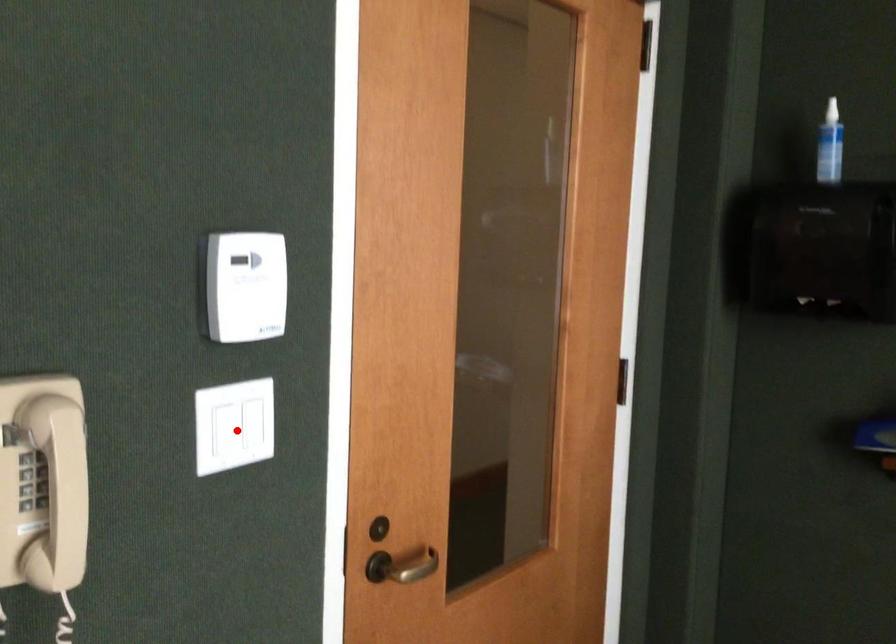
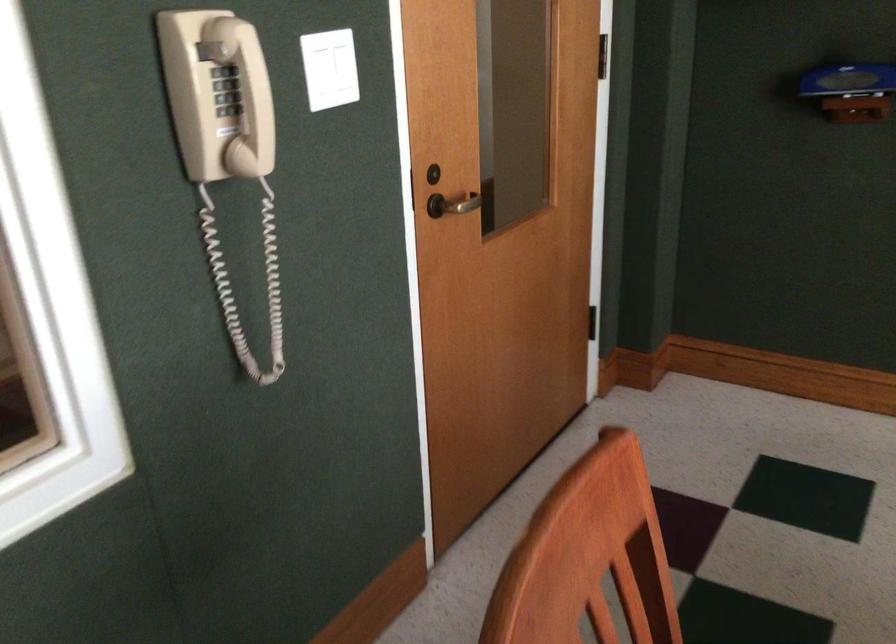
In the second image, find the point that corresponds to the highlighted location in the first image.

(330, 69)